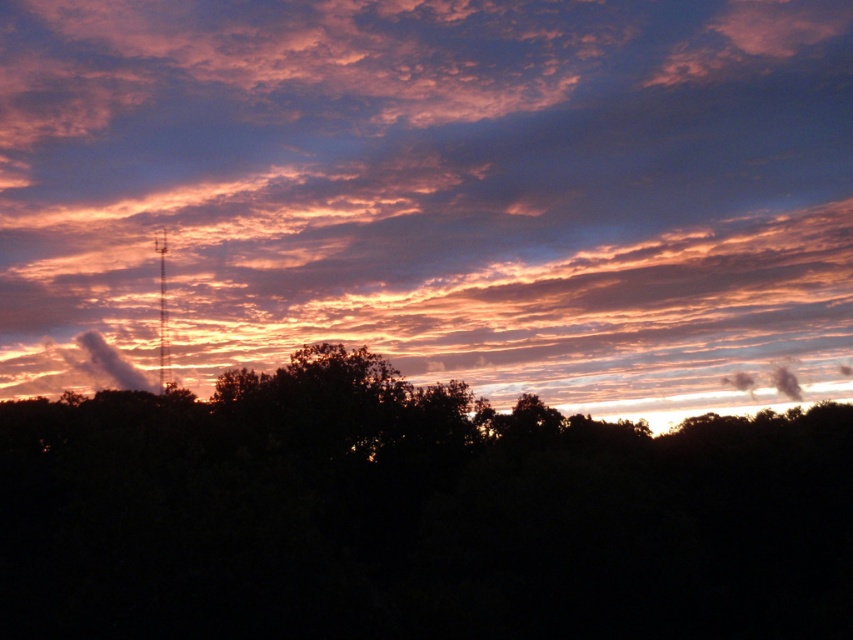
Question: Which object is farther from the camera taking this photo?

Choices:
 (A) cloudy sky at upper center
 (B) dark green leafy tree at center

Answer: (A)

Question: Does cloudy sky at upper center have a greater width compared to dark green leafy tree at center?

Choices:
 (A) yes
 (B) no

Answer: (A)

Question: Which of the following is the farthest from the observer?

Choices:
 (A) cloudy sky at upper center
 (B) dark green leafy tree at center

Answer: (A)

Question: Which object appears farthest from the camera in this image?

Choices:
 (A) cloudy sky at upper center
 (B) dark green leafy tree at center

Answer: (A)

Question: Considering the relative positions of cloudy sky at upper center and dark green leafy tree at center in the image provided, where is cloudy sky at upper center located with respect to dark green leafy tree at center?

Choices:
 (A) above
 (B) below

Answer: (A)

Question: Can you confirm if cloudy sky at upper center is bigger than dark green leafy tree at center?

Choices:
 (A) yes
 (B) no

Answer: (A)